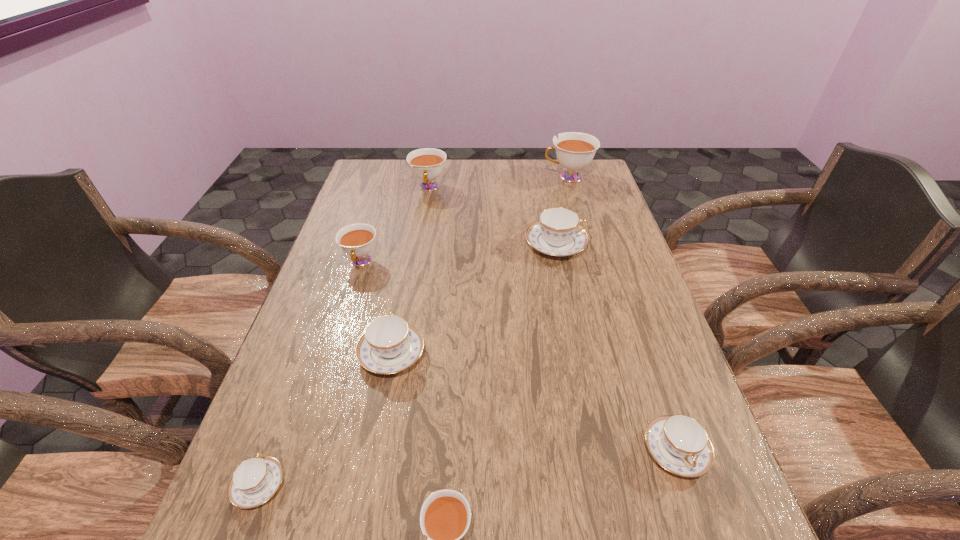
Locate an element on the screen. the smallest blue teacup is located at coordinates (255, 480).

Locate an element on the screen. The height and width of the screenshot is (540, 960). the shortest object is located at coordinates (255, 480).

Where is `vacant position located on the side of the biggest white teacup with the handle`? The width and height of the screenshot is (960, 540). vacant position located on the side of the biggest white teacup with the handle is located at coordinates click(453, 177).

Locate an element on the screen. The image size is (960, 540). vacant space located 0.100m on the side of the biggest white teacup with the handle is located at coordinates (515, 177).

Where is `vacant space located 0.170m on the side of the biggest white teacup with the handle`? vacant space located 0.170m on the side of the biggest white teacup with the handle is located at coordinates (495, 177).

Image resolution: width=960 pixels, height=540 pixels. Identify the location of blank space located on the side of the second white teacup from left to right with the handle. (414, 281).

Where is `free spot located on the side with the handle of the farthest blue teacup`? The width and height of the screenshot is (960, 540). free spot located on the side with the handle of the farthest blue teacup is located at coordinates (614, 245).

This screenshot has height=540, width=960. I want to click on vacant region located on the side of the third farthest white teacup with the handle, so click(340, 331).

You are a GUI agent. You are given a task and a screenshot of the screen. Output one action in this format:
    pyautogui.click(x=<x>, y=<y>)
    Task: Click on the vacant space located on the side with the handle of the third smallest blue teacup
    
    Given the screenshot: What is the action you would take?
    pyautogui.click(x=414, y=235)

Identify the location of vacant space situated 0.250m on the side with the handle of the third smallest blue teacup. (409, 260).